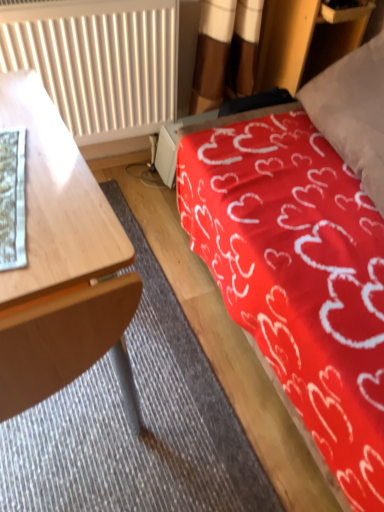
Question: Can you confirm if white paper at left is thinner than wooden desk at left?

Choices:
 (A) no
 (B) yes

Answer: (B)

Question: From a real-world perspective, is white paper at left positioned under wooden desk at left based on gravity?

Choices:
 (A) no
 (B) yes

Answer: (A)

Question: From the image's perspective, is white paper at left below wooden desk at left?

Choices:
 (A) no
 (B) yes

Answer: (A)

Question: Can we say white paper at left lies outside wooden desk at left?

Choices:
 (A) yes
 (B) no

Answer: (B)

Question: Does white paper at left have a greater height compared to wooden desk at left?

Choices:
 (A) yes
 (B) no

Answer: (B)

Question: Is wooden desk at left inside or outside of white paper at left?

Choices:
 (A) outside
 (B) inside

Answer: (A)

Question: Visually, is wooden desk at left positioned to the left or to the right of white paper at left?

Choices:
 (A) left
 (B) right

Answer: (B)

Question: From a real-world perspective, is wooden desk at left physically located above or below white paper at left?

Choices:
 (A) above
 (B) below

Answer: (B)

Question: Considering their positions, is wooden desk at left located in front of or behind white paper at left?

Choices:
 (A) behind
 (B) front

Answer: (B)

Question: From their relative heights in the image, would you say wooden desk at left is taller or shorter than white textured radiator at upper left?

Choices:
 (A) tall
 (B) short

Answer: (A)

Question: Considering the relative positions of wooden desk at left and white textured radiator at upper left in the image provided, is wooden desk at left to the left or to the right of white textured radiator at upper left?

Choices:
 (A) left
 (B) right

Answer: (A)

Question: From the image's perspective, is wooden desk at left located above or below white textured radiator at upper left?

Choices:
 (A) above
 (B) below

Answer: (B)

Question: Is wooden desk at left inside or outside of white textured radiator at upper left?

Choices:
 (A) inside
 (B) outside

Answer: (B)

Question: In terms of width, does white textured radiator at upper left look wider or thinner when compared to red fabric bed at upper right?

Choices:
 (A) wide
 (B) thin

Answer: (B)

Question: From a real-world perspective, is white textured radiator at upper left above or below red fabric bed at upper right?

Choices:
 (A) above
 (B) below

Answer: (A)